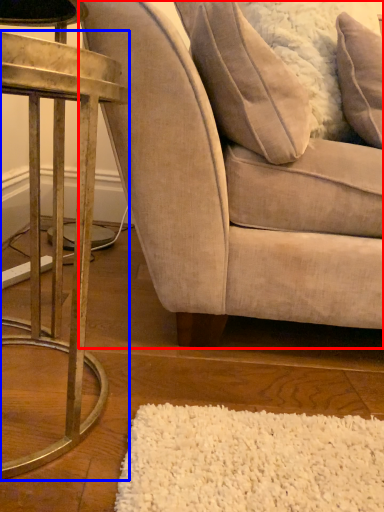
Question: Among these objects, which one is farthest to the camera, chair (highlighted by a red box) or table (highlighted by a blue box)?

Choices:
 (A) chair
 (B) table

Answer: (A)